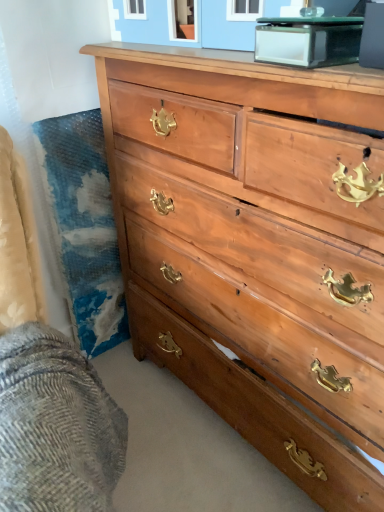
Question: Are woolen fabric at lower left and clear glass table at upper center located far from each other?

Choices:
 (A) no
 (B) yes

Answer: (A)

Question: Is woolen fabric at lower left to the left of clear glass table at upper center from the viewer's perspective?

Choices:
 (A) no
 (B) yes

Answer: (B)

Question: Is woolen fabric at lower left surrounding clear glass table at upper center?

Choices:
 (A) yes
 (B) no

Answer: (B)

Question: Is woolen fabric at lower left not inside clear glass table at upper center?

Choices:
 (A) no
 (B) yes

Answer: (B)

Question: Is woolen fabric at lower left placed right next to clear glass table at upper center?

Choices:
 (A) no
 (B) yes

Answer: (A)

Question: Considering the relative positions of woolen fabric at lower left and clear glass table at upper center in the image provided, is woolen fabric at lower left to the left or to the right of clear glass table at upper center?

Choices:
 (A) right
 (B) left

Answer: (B)

Question: Relative to clear glass table at upper center, is woolen fabric at lower left in front or behind?

Choices:
 (A) front
 (B) behind

Answer: (A)

Question: Is point (48, 330) closer or farther from the camera than point (334, 25)?

Choices:
 (A) closer
 (B) farther

Answer: (B)

Question: Considering the positions of woolen fabric at lower left and clear glass table at upper center in the image, is woolen fabric at lower left wider or thinner than clear glass table at upper center?

Choices:
 (A) wide
 (B) thin

Answer: (A)

Question: From a real-world perspective, is light brown wood chest of drawers at center physically located above or below woolen fabric at lower left?

Choices:
 (A) above
 (B) below

Answer: (A)

Question: Considering the positions of light brown wood chest of drawers at center and woolen fabric at lower left in the image, is light brown wood chest of drawers at center wider or thinner than woolen fabric at lower left?

Choices:
 (A) wide
 (B) thin

Answer: (A)

Question: Is point (x=248, y=83) closer or farther from the camera than point (x=36, y=411)?

Choices:
 (A) closer
 (B) farther

Answer: (B)

Question: In terms of size, does light brown wood chest of drawers at center appear bigger or smaller than woolen fabric at lower left?

Choices:
 (A) small
 (B) big

Answer: (B)

Question: Is woolen fabric at lower left in front of or behind light brown wood chest of drawers at center in the image?

Choices:
 (A) behind
 (B) front

Answer: (B)

Question: Considering the relative positions of woolen fabric at lower left and light brown wood chest of drawers at center in the image provided, is woolen fabric at lower left to the left or to the right of light brown wood chest of drawers at center?

Choices:
 (A) left
 (B) right

Answer: (A)